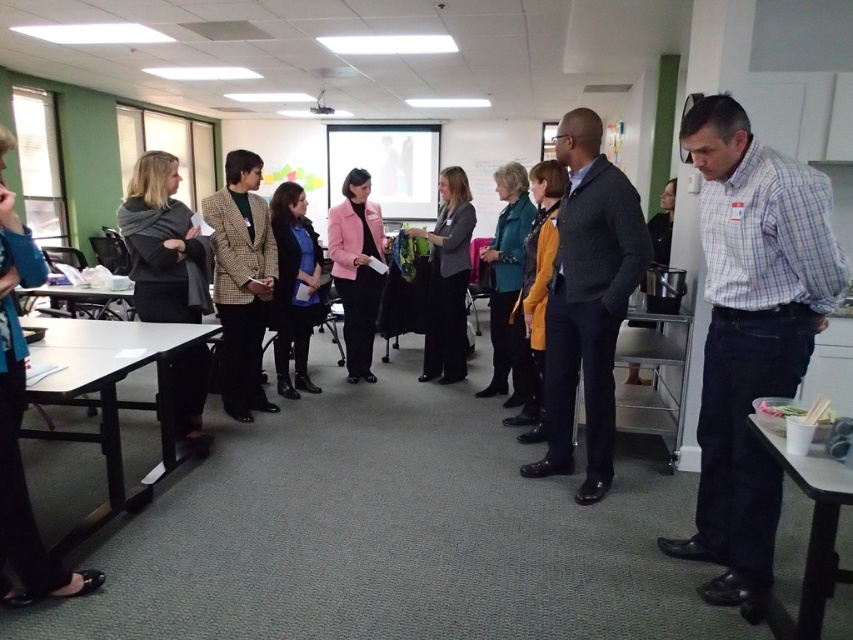
Is blue plaid shirt at right shorter than matte gray blazer at center?

No.

Identify the location of blue plaid shirt at right. (750, 332).

At what (x,y) coordinates should I click in order to perform the action: click on blue plaid shirt at right. Please return your answer as a coordinate pair (x, y). Looking at the image, I should click on (750, 332).

Does knit sweater at center lie behind blue fabric jacket at center?

No, it is not.

Does knit sweater at center appear over blue fabric jacket at center?

Actually, knit sweater at center is below blue fabric jacket at center.

The height and width of the screenshot is (640, 853). What are the coordinates of `knit sweater at center` in the screenshot? It's located at (587, 300).

The width and height of the screenshot is (853, 640). What do you see at coordinates (112, 397) in the screenshot?
I see `smooth black table at lower left` at bounding box center [112, 397].

Is point (109, 509) positioned in front of point (460, 276)?

Yes, it is.

This screenshot has width=853, height=640. What are the coordinates of `smooth black table at lower left` in the screenshot? It's located at (112, 397).